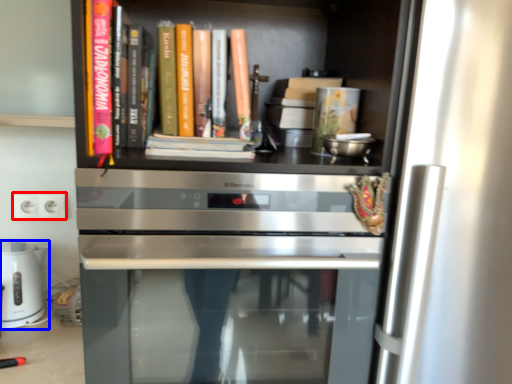
Question: Which point is closer to the camera, electric outlet (highlighted by a red box) or home appliance (highlighted by a blue box)?

Choices:
 (A) electric outlet
 (B) home appliance

Answer: (B)